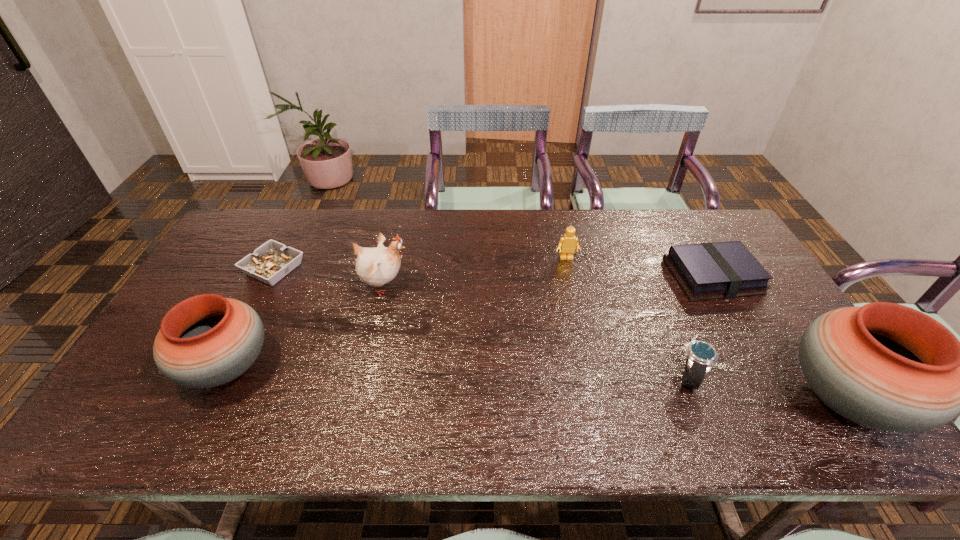
Identify the location of ashtray that is at the left edge. (269, 263).

This screenshot has width=960, height=540. I want to click on pottery located in the right edge section of the desktop, so click(887, 366).

Identify the location of book positioned at the right edge. (720, 270).

The image size is (960, 540). I want to click on object present at the far left corner, so pyautogui.click(x=269, y=263).

Image resolution: width=960 pixels, height=540 pixels. What are the coordinates of `object located at the near left corner` in the screenshot? It's located at (207, 340).

Find the location of `object present at the near right corner`. object present at the near right corner is located at coordinates (887, 366).

Find the location of `vacant region at the far edge`. vacant region at the far edge is located at coordinates (314, 246).

Locate an element on the screen. vacant space at the near edge of the desktop is located at coordinates (322, 394).

This screenshot has width=960, height=540. I want to click on vacant region at the left edge, so click(x=210, y=274).

You are a GUI agent. You are given a task and a screenshot of the screen. Output one action in this format:
    pyautogui.click(x=<x>, y=<y>)
    Task: Click on the free space at the right edge of the desktop
    
    Given the screenshot: What is the action you would take?
    pyautogui.click(x=747, y=296)